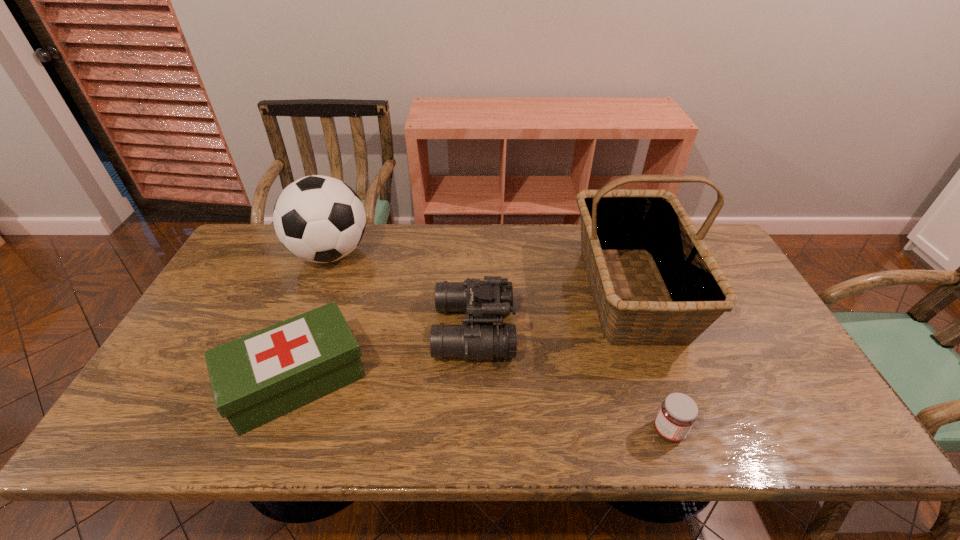
Locate an element on the screen. basket is located at coordinates (614, 221).

Where is `soccer ball`? The height and width of the screenshot is (540, 960). soccer ball is located at coordinates (320, 219).

At what (x,y) coordinates should I click in order to perform the action: click on the third object from left to right. Please return your answer as a coordinate pair (x, y). Looking at the image, I should click on (485, 301).

This screenshot has width=960, height=540. I want to click on the third tallest object, so click(485, 301).

Where is `the first-aid kit`? This screenshot has width=960, height=540. the first-aid kit is located at coordinates (257, 378).

Locate an element on the screen. Image resolution: width=960 pixels, height=540 pixels. jam is located at coordinates (678, 412).

This screenshot has width=960, height=540. What are the coordinates of `vacant space located 0.100m by the handle of the tallest object` in the screenshot? It's located at (668, 395).

Find the location of a particular element. The width and height of the screenshot is (960, 540). vacant space located 0.290m on the front of the soccer ball is located at coordinates (289, 357).

Where is `vacant area located 0.350m through the lenses of the binoculars`? The width and height of the screenshot is (960, 540). vacant area located 0.350m through the lenses of the binoculars is located at coordinates (641, 329).

At what (x,y) coordinates should I click in order to perform the action: click on free space located 0.100m on the right of the first-aid kit. Please return your answer as a coordinate pair (x, y). Looking at the image, I should click on (408, 380).